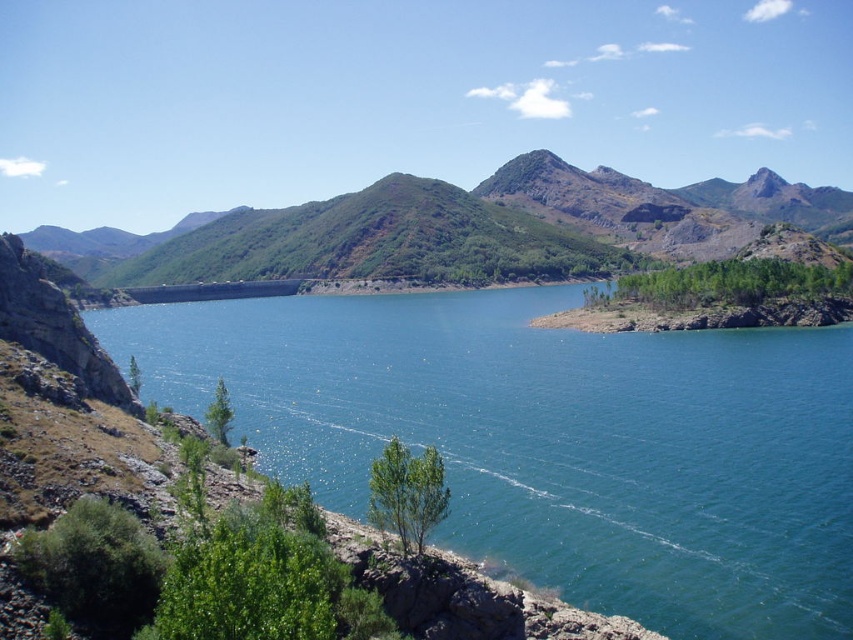
Between blue water at center and green textured mountain at center, which one is positioned lower?

blue water at center is below.

Describe the element at coordinates (550, 440) in the screenshot. The width and height of the screenshot is (853, 640). I see `blue water at center` at that location.

The image size is (853, 640). Describe the element at coordinates (550, 440) in the screenshot. I see `blue water at center` at that location.

You are a GUI agent. You are given a task and a screenshot of the screen. Output one action in this format:
    pyautogui.click(x=<x>, y=<y>)
    Task: Click on the blue water at center
    
    Given the screenshot: What is the action you would take?
    pyautogui.click(x=550, y=440)